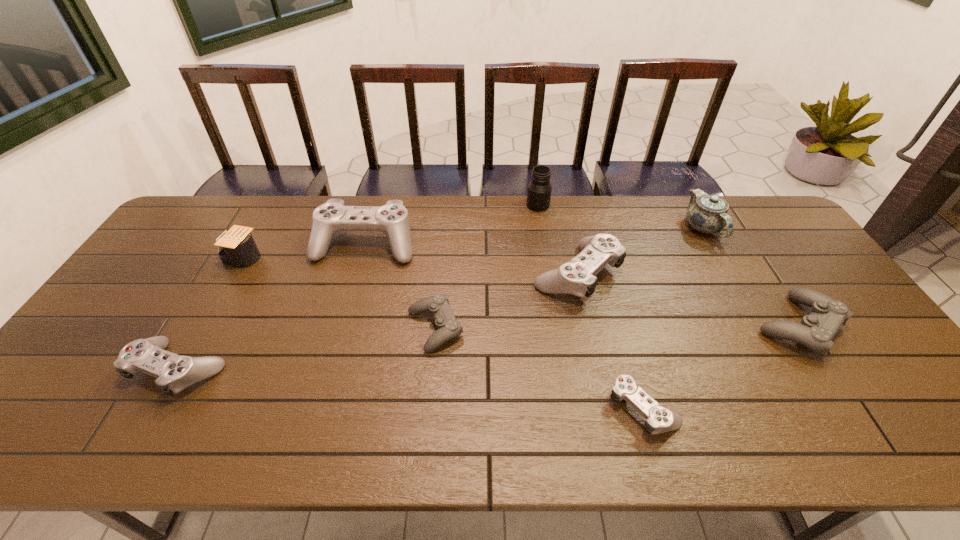
What are the coordinates of `object that is the fourth nearest to the jar` in the screenshot? It's located at (448, 327).

Select which object appears as the third closest to the jar. Please provide its 2D coordinates. Your answer should be formatted as a tuple, i.e. [(x, y)], where the tuple contains the x and y coordinates of a point satisfying the conditions above.

[(706, 213)]

I want to click on control object that ranks as the third closest to the jar, so click(448, 327).

What are the coordinates of `control that stands as the second closest to the calculator` in the screenshot? It's located at (174, 373).

At what (x,y) coordinates should I click in order to perform the action: click on white control that stands as the fourth closest to the chinaware. Please return your answer as a coordinate pair (x, y). Looking at the image, I should click on (174, 373).

Locate an element on the screen. The width and height of the screenshot is (960, 540). white control object that ranks as the third closest to the left gray control is located at coordinates (659, 419).

Where is `blank space that satisfies the following two spatial constraints: 1. on the back side of the jar; 2. on the right side of the tallest control`? The image size is (960, 540). blank space that satisfies the following two spatial constraints: 1. on the back side of the jar; 2. on the right side of the tallest control is located at coordinates [x=375, y=205].

This screenshot has height=540, width=960. Find the location of `free space that satisfies the following two spatial constraints: 1. on the front side of the third control from left to right; 2. on the left side of the smallest white control`. free space that satisfies the following two spatial constraints: 1. on the front side of the third control from left to right; 2. on the left side of the smallest white control is located at coordinates (428, 406).

At what (x,y) coordinates should I click in order to perform the action: click on free space that satisfies the following two spatial constraints: 1. on the front side of the second biggest white control; 2. on the left side of the smallest white control. Please return your answer as a coordinate pair (x, y). Looking at the image, I should click on (606, 406).